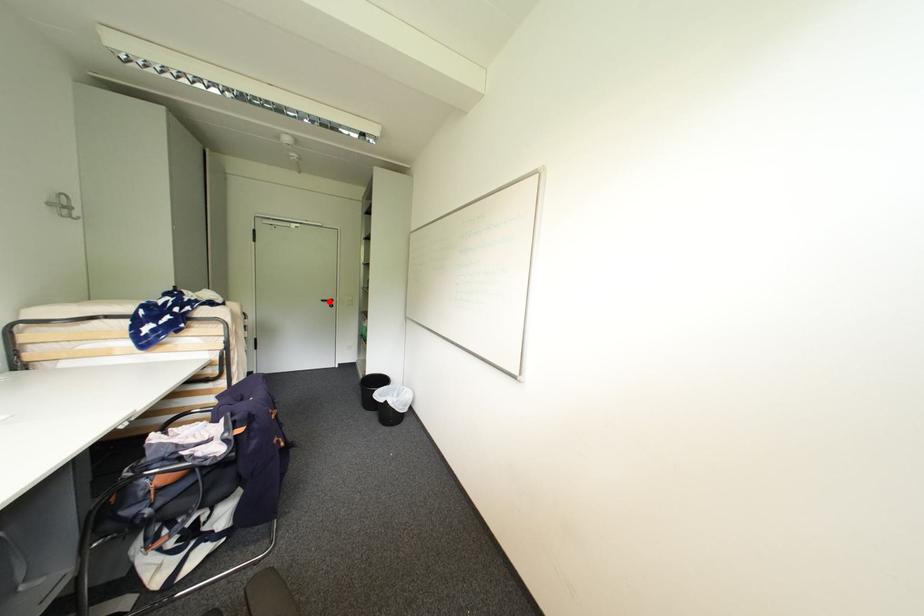
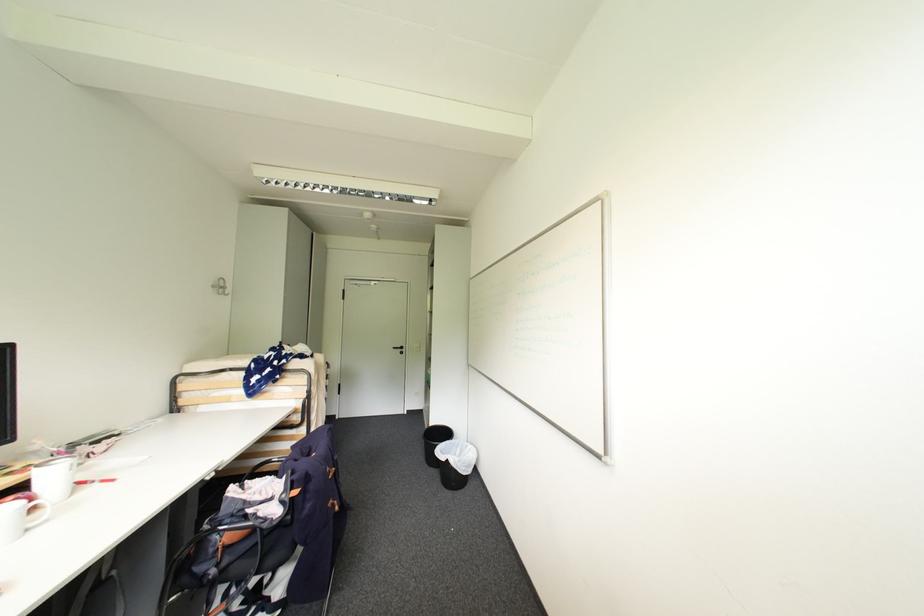
Question: I am providing you with two images of the same scene from different viewpoints. Image1 has a red point marked. In image2, the corresponding 3D location appears at what relative position? Reply with the corresponding letter.

Choices:
 (A) Closer
 (B) Farther

Answer: (B)